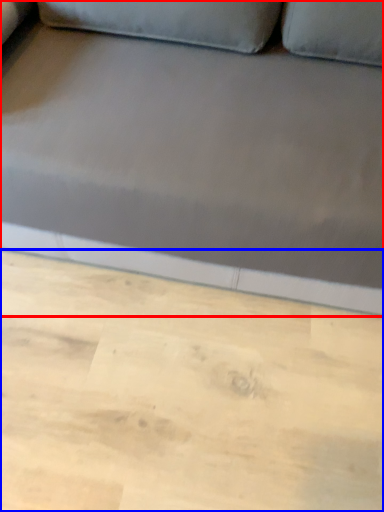
Question: Which object appears closest to the camera in this image, studio couch (highlighted by a red box) or plywood (highlighted by a blue box)?

Choices:
 (A) studio couch
 (B) plywood

Answer: (A)